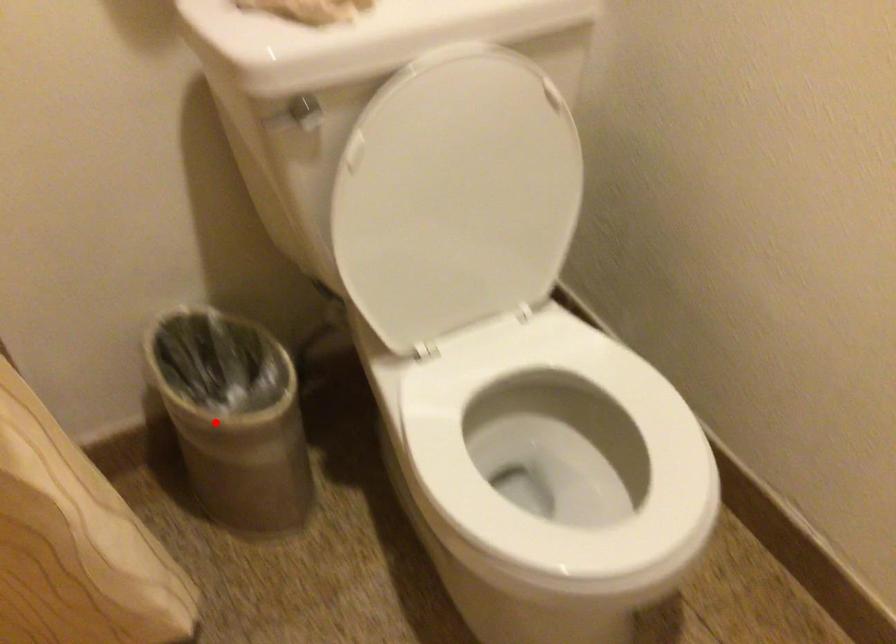
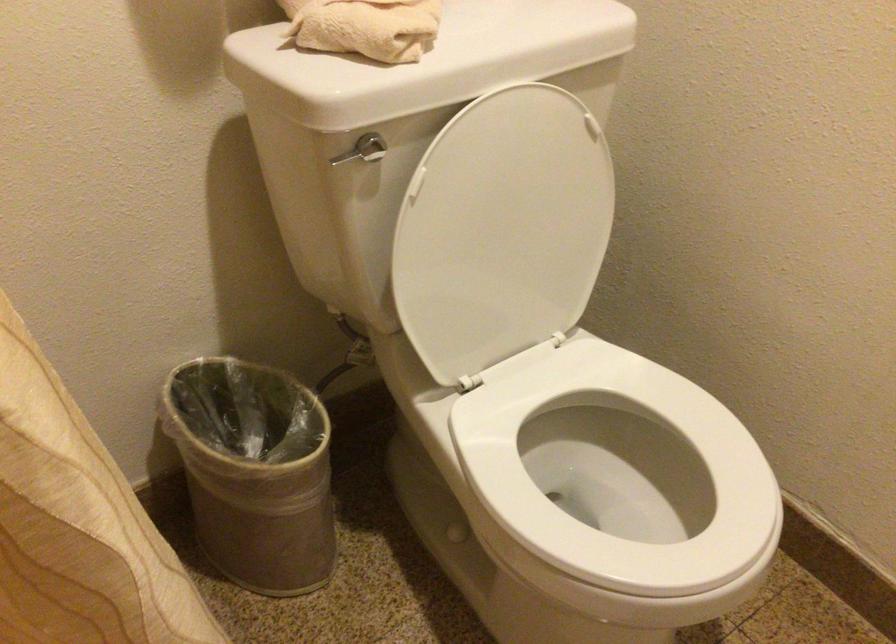
Locate, in the second image, the point that corresponds to the highlighted location in the first image.

(254, 471)